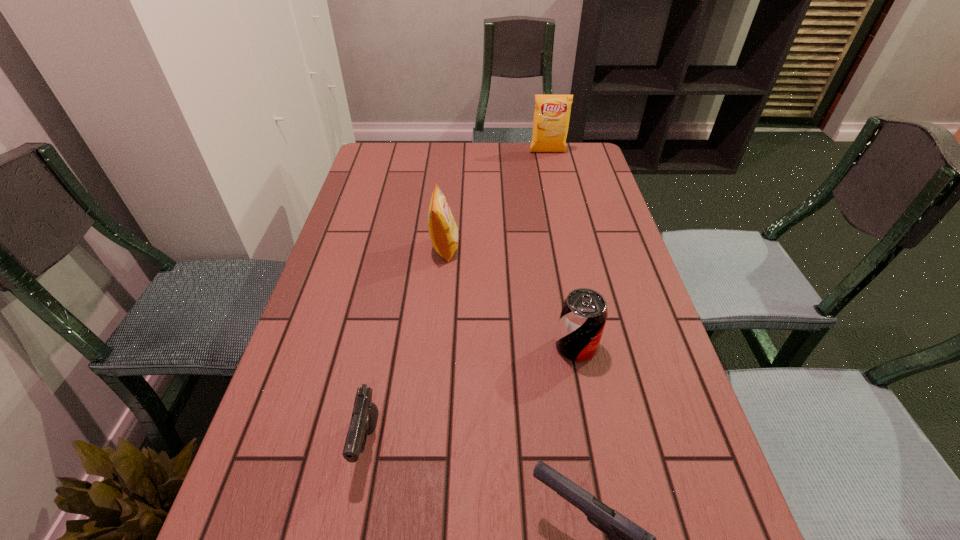
I want to click on the farther crisp (potato chip), so click(x=552, y=112).

Identify the location of the tallest object. Image resolution: width=960 pixels, height=540 pixels. (552, 112).

Identify the location of the second farthest object. The height and width of the screenshot is (540, 960). (443, 231).

The image size is (960, 540). Identify the location of the shorter crisp (potato chip). (443, 231).

At what (x,y) coordinates should I click in order to perform the action: click on soda can. Please return your answer as a coordinate pair (x, y). The width and height of the screenshot is (960, 540). Looking at the image, I should click on (584, 312).

At what (x,y) coordinates should I click in order to perform the action: click on the shortest object. Please return your answer as a coordinate pair (x, y). The width and height of the screenshot is (960, 540). Looking at the image, I should click on pos(364,417).

Where is `the leftmost object`? This screenshot has width=960, height=540. the leftmost object is located at coordinates (364, 417).

Where is `vacant space located 0.210m on the front of the taller crisp (potato chip) with the logo`? The width and height of the screenshot is (960, 540). vacant space located 0.210m on the front of the taller crisp (potato chip) with the logo is located at coordinates (556, 187).

Where is `free spot located 0.180m on the front-facing side of the nearer crisp (potato chip)`? The height and width of the screenshot is (540, 960). free spot located 0.180m on the front-facing side of the nearer crisp (potato chip) is located at coordinates (524, 248).

Where is `blank space located on the front of the third farthest object`? This screenshot has height=540, width=960. blank space located on the front of the third farthest object is located at coordinates (602, 479).